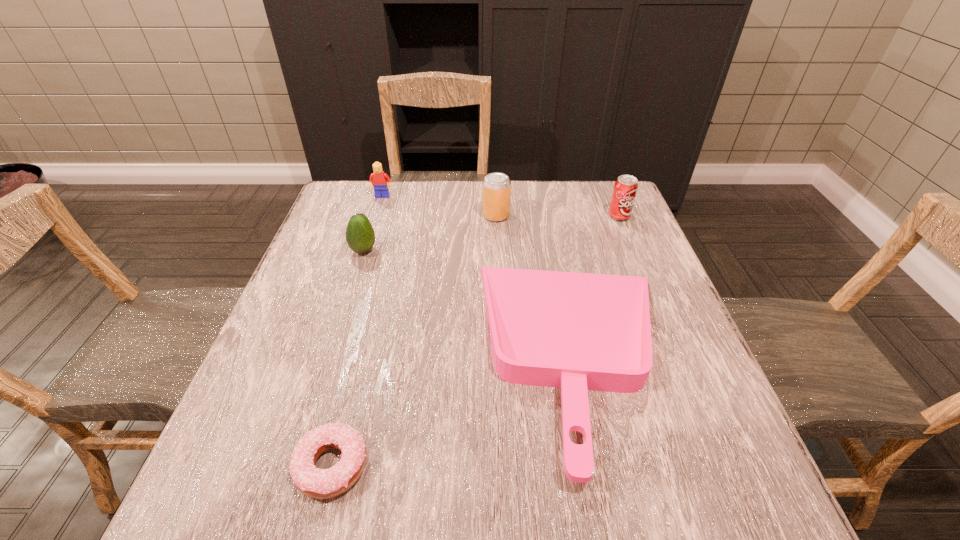
In the image, there is a desktop. What are the coordinates of `vacant area at the far right corner` in the screenshot? It's located at (610, 204).

The width and height of the screenshot is (960, 540). I want to click on blank space at the near right corner, so click(718, 505).

You are a GUI agent. You are given a task and a screenshot of the screen. Output one action in this format:
    pyautogui.click(x=<x>, y=<y>)
    Task: Click on the vacant region between the left soda and the right soda
    Image resolution: width=960 pixels, height=540 pixels.
    Given the screenshot: What is the action you would take?
    pyautogui.click(x=558, y=216)

Locate an element on the screen. This screenshot has width=960, height=540. free spot between the dustpan and the third nearest object is located at coordinates (471, 302).

Identify the location of vacant area between the second shortest object and the shortest object. This screenshot has width=960, height=540. (457, 410).

Locate an element on the screen. The image size is (960, 540). unoccupied area between the doughnut and the dustpan is located at coordinates (457, 410).

The image size is (960, 540). In order to click on vacant space that is in between the farthest object and the doughnut in this screenshot , I will do `click(357, 331)`.

Where is `vacant space that is in between the fifth tallest object and the shortest object`? vacant space that is in between the fifth tallest object and the shortest object is located at coordinates (457, 410).

Where is `vacant area that lies between the avocado and the farthest object`? vacant area that lies between the avocado and the farthest object is located at coordinates (372, 224).

At what (x,y) coordinates should I click in order to perform the action: click on free space between the Lego and the shortest object. Please return your answer as a coordinate pair (x, y). The width and height of the screenshot is (960, 540). Looking at the image, I should click on click(357, 331).